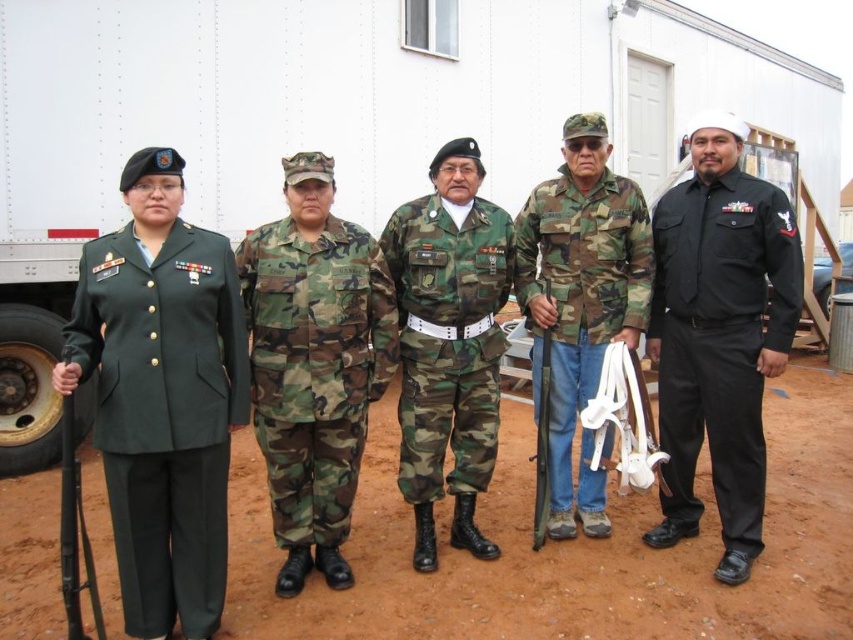
Looking at this image, does camo fabric uniform at center have a greater height compared to camo fabric jacket at center?

In fact, camo fabric uniform at center may be shorter than camo fabric jacket at center.

Is camo fabric uniform at center smaller than camo fabric jacket at center?

Correct, camo fabric uniform at center occupies less space than camo fabric jacket at center.

Does point (393, 224) lie behind point (538, 285)?

No, (393, 224) is in front of (538, 285).

Where is `camo fabric uniform at center`? camo fabric uniform at center is located at coordinates (448, 339).

Between green matte uniform at left and camo fabric uniform at center, which one appears on the left side from the viewer's perspective?

From the viewer's perspective, green matte uniform at left appears more on the left side.

Is green matte uniform at left closer to camera compared to camo fabric uniform at center?

Yes, it is.

Where is `green matte uniform at left`? green matte uniform at left is located at coordinates (163, 412).

Looking at this image, is camouflage fabric uniform at center closer to the viewer compared to camo fabric jacket at center?

That is True.

At what (x,y) coordinates should I click in order to perform the action: click on camouflage fabric uniform at center. Please return your answer as a coordinate pair (x, y). The image size is (853, 640). Looking at the image, I should click on (315, 365).